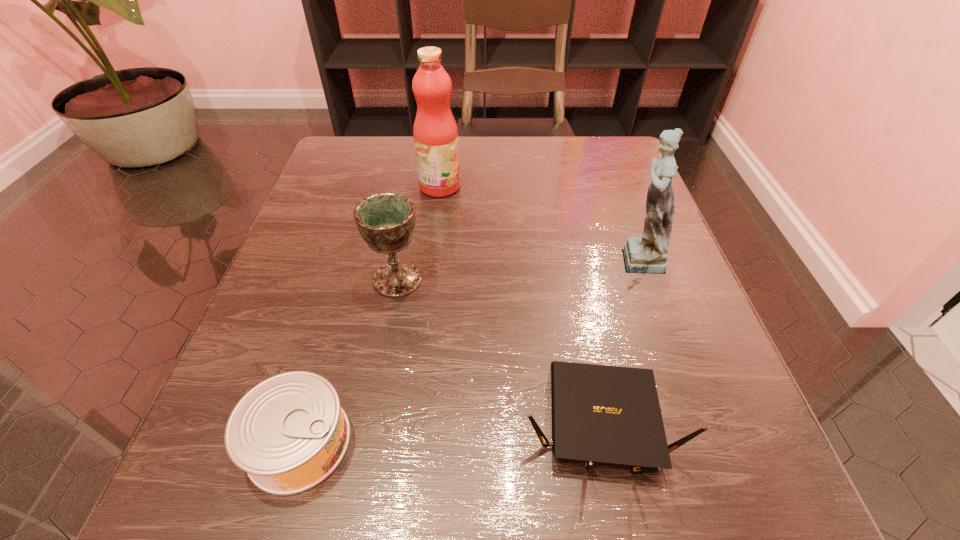
Find the location of `the farthest object`. the farthest object is located at coordinates [435, 132].

Where is `figurine`? figurine is located at coordinates (648, 254).

This screenshot has height=540, width=960. In order to click on the third shortest object in this screenshot , I will do `click(386, 221)`.

Locate an element on the screen. This screenshot has width=960, height=540. the fourth tallest object is located at coordinates (600, 413).

This screenshot has height=540, width=960. I want to click on can, so click(289, 433).

Where is `free space located on the front label of the fruit juice`? The image size is (960, 540). free space located on the front label of the fruit juice is located at coordinates (585, 186).

Where is `vacant area situated 0.150m on the front-facing side of the figurine`? vacant area situated 0.150m on the front-facing side of the figurine is located at coordinates (525, 257).

Where is `vacant space located 0.200m on the front-facing side of the figurine`? The width and height of the screenshot is (960, 540). vacant space located 0.200m on the front-facing side of the figurine is located at coordinates click(497, 257).

At what (x,y) coordinates should I click in order to perform the action: click on free space located on the front-facing side of the figurine. Please return your answer as a coordinate pair (x, y). Looking at the image, I should click on (398, 257).

Locate an element on the screen. The height and width of the screenshot is (540, 960). vacant space located on the front of the third shortest object is located at coordinates (385, 349).